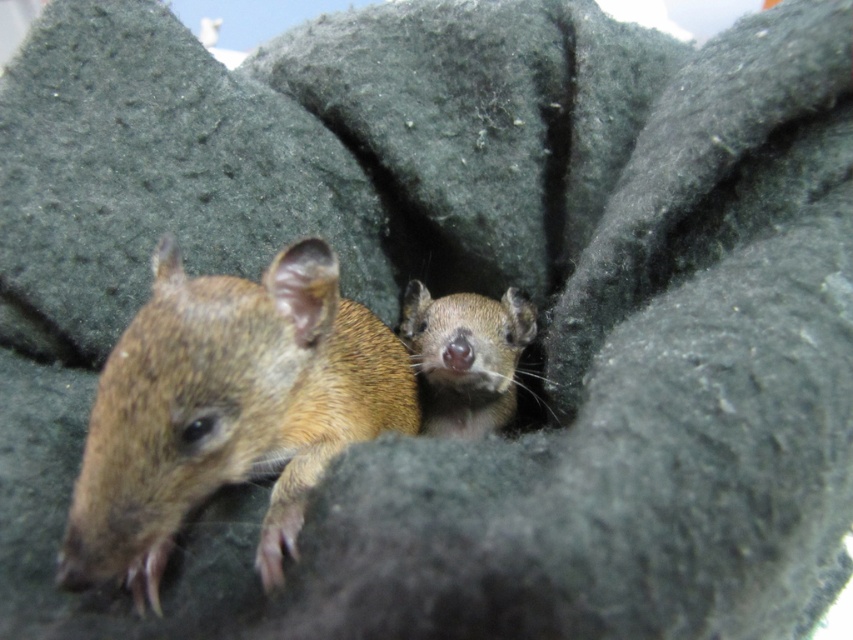
Is point (158, 536) behind point (515, 332)?

No.

Is point (264, 291) more distant than point (410, 292)?

No.

Identify the location of brown fuzzy mouse at left. This screenshot has width=853, height=640. (227, 410).